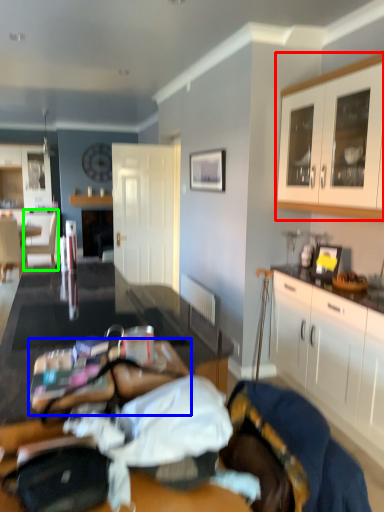
Question: Which is nearer to the cabinetry (highlighted by a red box)? table (highlighted by a blue box) or armchair (highlighted by a green box).

Choices:
 (A) table
 (B) armchair

Answer: (A)